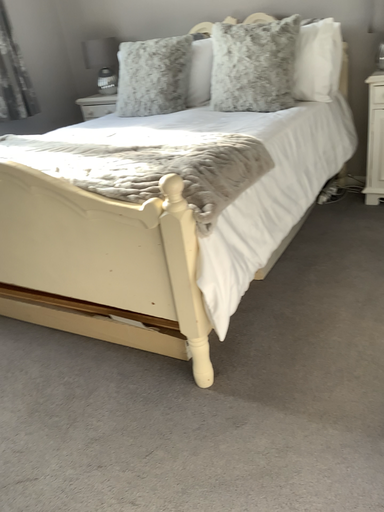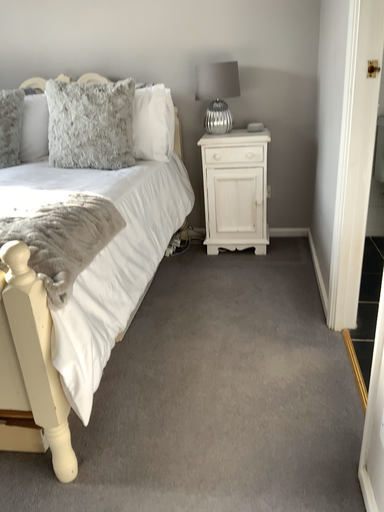
Question: Which way did the camera rotate in the video?

Choices:
 (A) rotated left
 (B) rotated right

Answer: (B)